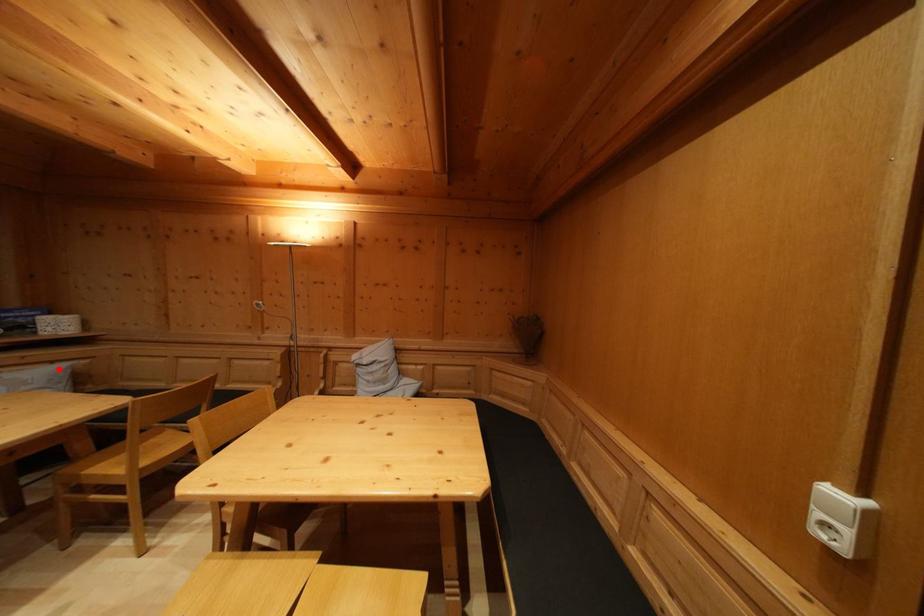
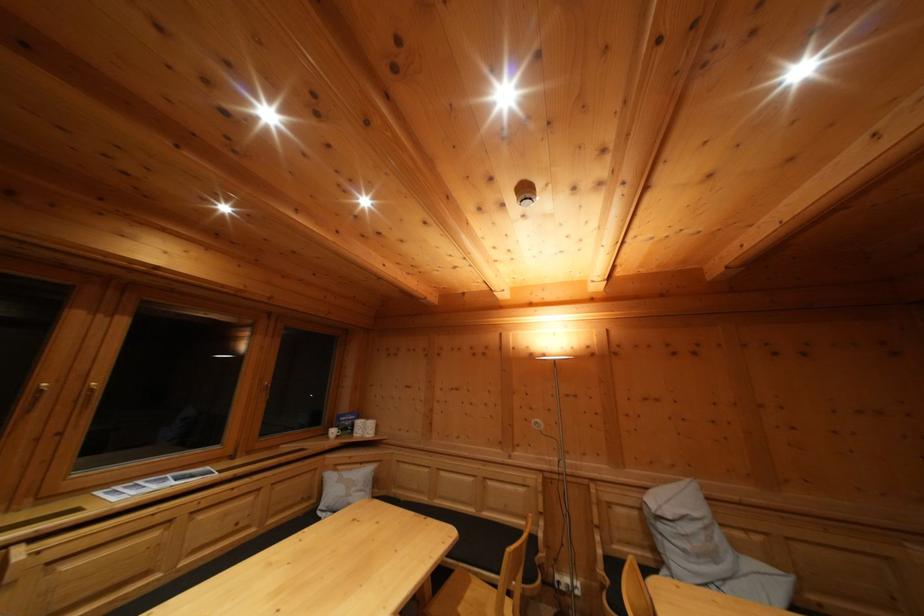
Where in the second image is the point corresponding to the highlighted location from the first image?

(368, 469)